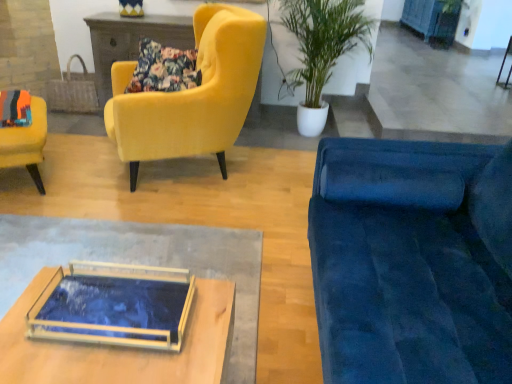
Image resolution: width=512 pixels, height=384 pixels. What do you see at coordinates (164, 69) in the screenshot?
I see `floral fabric pillow at upper left` at bounding box center [164, 69].

How much space does velvet yellow armchair at upper left, arranged as the first chair when viewed from the right, occupy vertically?

1.04 meters.

What do you see at coordinates (412, 261) in the screenshot?
I see `velvet blue couch at right` at bounding box center [412, 261].

Locate an element on the screen. green leafy plant in white pot at upper center is located at coordinates (322, 49).

The image size is (512, 384). What do you see at coordinates (322, 49) in the screenshot?
I see `green leafy plant in white pot at upper center` at bounding box center [322, 49].

In order to click on woven straw handbag at upper left in this screenshot , I will do `click(72, 92)`.

Does point (189, 71) come behind point (245, 28)?

Yes.

How different are the orientations of floral fabric pillow at upper left and velvet yellow armchair at upper left, the second chair positioned from the left, in degrees?

51.9 degrees.

Considering the positions of objects floral fabric pillow at upper left and velvet yellow armchair at upper left, the second chair positioned from the left, in the image provided, who is more to the right, floral fabric pillow at upper left or velvet yellow armchair at upper left, the second chair positioned from the left,?

Positioned to the right is velvet yellow armchair at upper left, the second chair positioned from the left.

From a real-world perspective, is floral fabric pillow at upper left over velvet yellow armchair at upper left, the second chair positioned from the left?

Indeed, from a real-world perspective, floral fabric pillow at upper left stands above velvet yellow armchair at upper left, the second chair positioned from the left.

Is woven straw handbag at upper left located within velvet blue couch at right?

That's incorrect, woven straw handbag at upper left is not inside velvet blue couch at right.

Based on the photo, which is more to the left, velvet blue couch at right or woven straw handbag at upper left?

Positioned to the left is woven straw handbag at upper left.

Considering the sizes of objects velvet blue couch at right and woven straw handbag at upper left in the image provided, who is smaller, velvet blue couch at right or woven straw handbag at upper left?

woven straw handbag at upper left.

Where is `handbag on the left of velvet blue couch at right`? Image resolution: width=512 pixels, height=384 pixels. handbag on the left of velvet blue couch at right is located at coordinates (72, 92).

Is point (5, 165) closer or farther from the camera than point (448, 368)?

Point (5, 165).

Is velvet yellow armchair at left, which appears as the 2th chair when viewed from the right, behind velvet blue couch at right?

Yes, velvet yellow armchair at left, which appears as the 2th chair when viewed from the right, is further from the camera.

Which is more to the right, velvet yellow armchair at left, which appears as the 2th chair when viewed from the right, or velvet blue couch at right?

Positioned to the right is velvet blue couch at right.

Which point is more distant from viewer, (86,104) or (422,165)?

Point (86,104)

In the image, is woven straw handbag at upper left positioned in front of or behind velvet blue couch at right?

Visually, woven straw handbag at upper left is located behind velvet blue couch at right.

Can you confirm if woven straw handbag at upper left is thinner than velvet blue couch at right?

Yes.

Can you tell me how much blue painted wood cabinet at upper right and translucent glass tray at center differ in facing direction?

They differ by 88.8 degrees in their facing directions.

Can you confirm if blue painted wood cabinet at upper right is bigger than translucent glass tray at center?

Yes.

Find the location of `desk below the blue painted wood cabinet at upper right (from the image's perspective)`. desk below the blue painted wood cabinet at upper right (from the image's perspective) is located at coordinates (141, 263).

Looking at this image, is blue painted wood cabinet at upper right oriented away from translucent glass tray at center?

No, blue painted wood cabinet at upper right's orientation is not away from translucent glass tray at center.

Which is closer to the camera, (181,85) or (8,223)?

The point (8,223) is in front.

Can you confirm if floral fabric pillow at upper left is wider than translucent glass tray at center?

No, floral fabric pillow at upper left is not wider than translucent glass tray at center.

Measure the distance between floral fabric pillow at upper left and translucent glass tray at center.

floral fabric pillow at upper left is 1.15 meters away from translucent glass tray at center.

Could you tell me if floral fabric pillow at upper left is facing translucent glass tray at center?

No.

This screenshot has width=512, height=384. In order to click on houseplant below the woven straw handbag at upper left (from the image's perspective) in this screenshot , I will do `click(322, 49)`.

Is woven straw handbag at upper left aimed at green leafy plant in white pot at upper center?

No, woven straw handbag at upper left is not oriented towards green leafy plant in white pot at upper center.

From a real-world perspective, who is located higher, woven straw handbag at upper left or green leafy plant in white pot at upper center?

In real-world perspective, green leafy plant in white pot at upper center is above.

Who is shorter, woven straw handbag at upper left or green leafy plant in white pot at upper center?

woven straw handbag at upper left is shorter.

I want to click on chair on the right side of floral fabric pillow at upper left, so pyautogui.click(x=192, y=94).

I want to click on handbag behind the velvet blue couch at right, so click(x=72, y=92).

Considering their positions, is floral fabric pillow at upper left positioned further to green leafy plant in white pot at upper center than velvet yellow armchair at upper left, the second chair positioned from the left?

Based on the image, floral fabric pillow at upper left appears to be further to green leafy plant in white pot at upper center.

Considering their positions, is blue painted wood cabinet at upper right positioned closer to woven straw handbag at upper left than translucent glass tray at center?

translucent glass tray at center lies closer to woven straw handbag at upper left than the other object.

Estimate the real-world distances between objects in this image. Which object is further from blue painted wood cabinet at upper right, velvet yellow armchair at left, which is the 1th chair in left-to-right order, or green leafy plant in white pot at upper center?

velvet yellow armchair at left, which is the 1th chair in left-to-right order.

From the image, which object appears to be farther from translucent glass tray at center, blue painted wood cabinet at upper right or green leafy plant in white pot at upper center?

Among the two, blue painted wood cabinet at upper right is located further to translucent glass tray at center.

Which object lies nearer to the anchor point woven straw handbag at upper left, blue painted wood cabinet at upper right or yellow and blue striped vase at upper center?

yellow and blue striped vase at upper center is closer to woven straw handbag at upper left.

From the image, which object appears to be nearer to green leafy plant in white pot at upper center, floral fabric pillow at upper left or blue painted wood cabinet at upper right?

floral fabric pillow at upper left lies closer to green leafy plant in white pot at upper center than the other object.

From the image, which object appears to be farther from floral fabric pillow at upper left, translucent glass tray at center or velvet yellow armchair at left, which is the 1th chair in left-to-right order?

translucent glass tray at center is further to floral fabric pillow at upper left.

Which object lies further to the anchor point woven straw handbag at upper left, velvet blue couch at right or green leafy plant in white pot at upper center?

Among the two, velvet blue couch at right is located further to woven straw handbag at upper left.

Where is `houseplant between velvet yellow armchair at left, which appears as the 2th chair when viewed from the right, and blue painted wood cabinet at upper right from left to right`? The image size is (512, 384). houseplant between velvet yellow armchair at left, which appears as the 2th chair when viewed from the right, and blue painted wood cabinet at upper right from left to right is located at coordinates (322, 49).

This screenshot has height=384, width=512. In order to click on vase located between woven straw handbag at upper left and green leafy plant in white pot at upper center in the left-right direction in this screenshot , I will do coord(131,8).

I want to click on pillow between velvet yellow armchair at left, which appears as the 2th chair when viewed from the right, and blue painted wood cabinet at upper right, so click(x=164, y=69).

At what (x,y) coordinates should I click in order to perform the action: click on pillow between yellow and blue striped vase at upper center and blue painted wood cabinet at upper right in the horizontal direction. Please return your answer as a coordinate pair (x, y). Looking at the image, I should click on (164, 69).